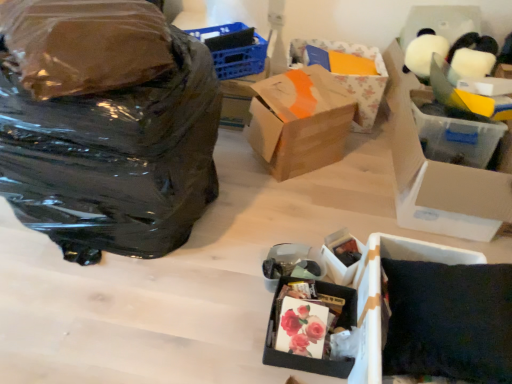
Question: Should I look upward or downward to see blue plastic basket at upper center?

Choices:
 (A) down
 (B) up

Answer: (B)

Question: From the image's perspective, is matte black box at lower center, which appears as the first box when ordered from the bottom, above matte black box at lower center, which is counted as the second box, starting from the bottom?

Choices:
 (A) no
 (B) yes

Answer: (A)

Question: From the image's perspective, is matte black box at lower center, which appears as the first box when ordered from the bottom, below matte black box at lower center, which is counted as the second box, starting from the bottom?

Choices:
 (A) no
 (B) yes

Answer: (B)

Question: Is matte black box at lower center, the 5th box when ordered from top to bottom, closer to camera compared to matte black box at lower center, the 4th box in the top-to-bottom sequence?

Choices:
 (A) no
 (B) yes

Answer: (B)

Question: Would you say matte black box at lower center, which appears as the first box when ordered from the bottom, is a long distance from matte black box at lower center, which is counted as the second box, starting from the bottom?

Choices:
 (A) no
 (B) yes

Answer: (A)

Question: Can we say matte black box at lower center, which appears as the first box when ordered from the bottom, lies outside matte black box at lower center, the 4th box in the top-to-bottom sequence?

Choices:
 (A) yes
 (B) no

Answer: (A)

Question: Can you confirm if matte black box at lower center, the 5th box when ordered from top to bottom, is positioned to the left of matte black box at lower center, which is counted as the second box, starting from the bottom?

Choices:
 (A) no
 (B) yes

Answer: (B)

Question: Can we say black plastic bag at left lies outside matte black box at lower center, the 5th box when ordered from top to bottom?

Choices:
 (A) no
 (B) yes

Answer: (B)

Question: Is black plastic bag at left thinner than matte black box at lower center, the 5th box when ordered from top to bottom?

Choices:
 (A) yes
 (B) no

Answer: (B)

Question: Is black plastic bag at left closer to camera compared to matte black box at lower center, the 5th box when ordered from top to bottom?

Choices:
 (A) yes
 (B) no

Answer: (A)

Question: Can you confirm if black plastic bag at left is taller than matte black box at lower center, which appears as the first box when ordered from the bottom?

Choices:
 (A) no
 (B) yes

Answer: (B)

Question: Considering the relative sizes of black plastic bag at left and matte black box at lower center, which appears as the first box when ordered from the bottom, in the image provided, is black plastic bag at left bigger than matte black box at lower center, which appears as the first box when ordered from the bottom,?

Choices:
 (A) no
 (B) yes

Answer: (B)

Question: Is black plastic bag at left further to the viewer compared to matte black box at lower center, which appears as the first box when ordered from the bottom?

Choices:
 (A) yes
 (B) no

Answer: (B)

Question: Is the position of brown cardboard box at center, which ranks as the 2th box in top-to-bottom order, more distant than that of dark fabric pillow at lower right?

Choices:
 (A) no
 (B) yes

Answer: (B)